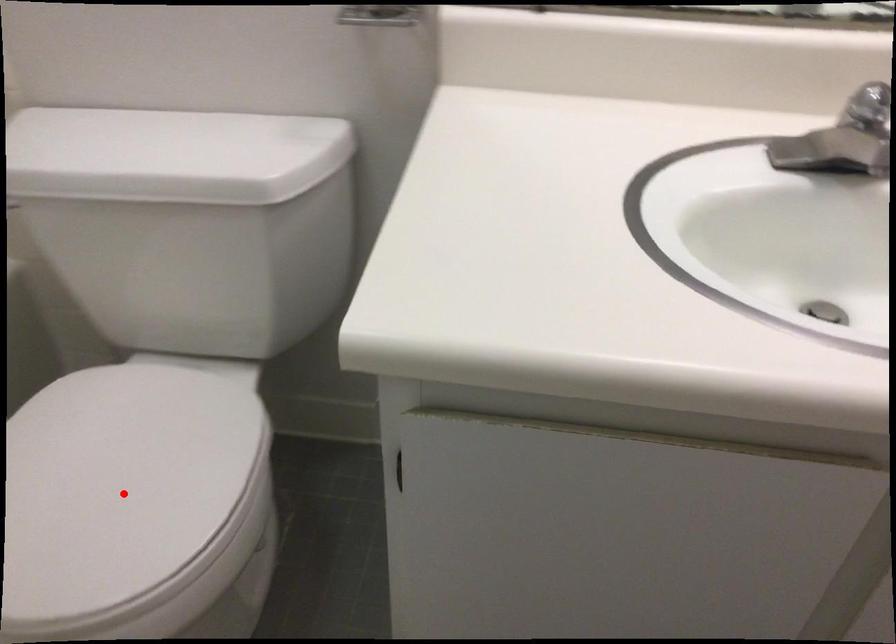
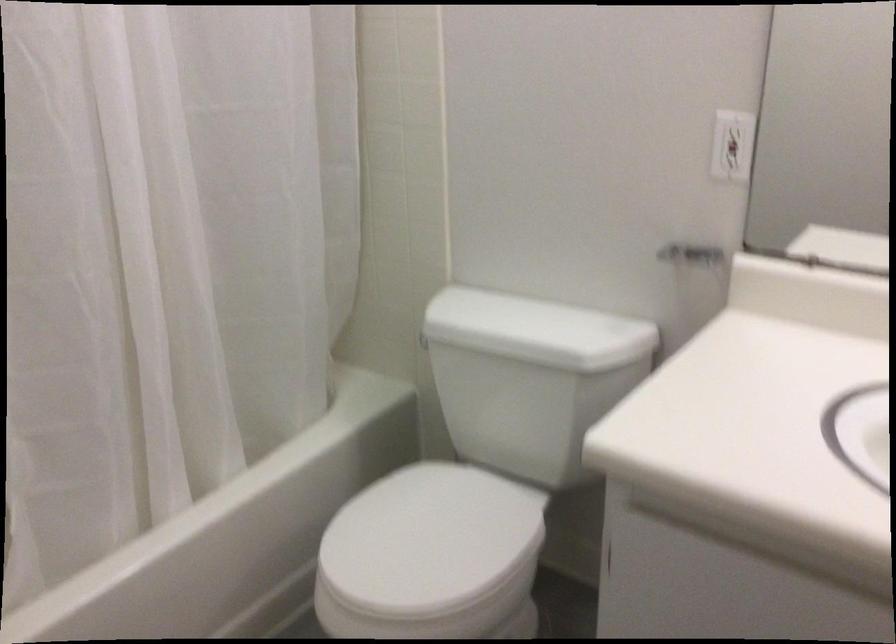
Find the pixel in the second image that matches the highlighted location in the first image.

(429, 540)